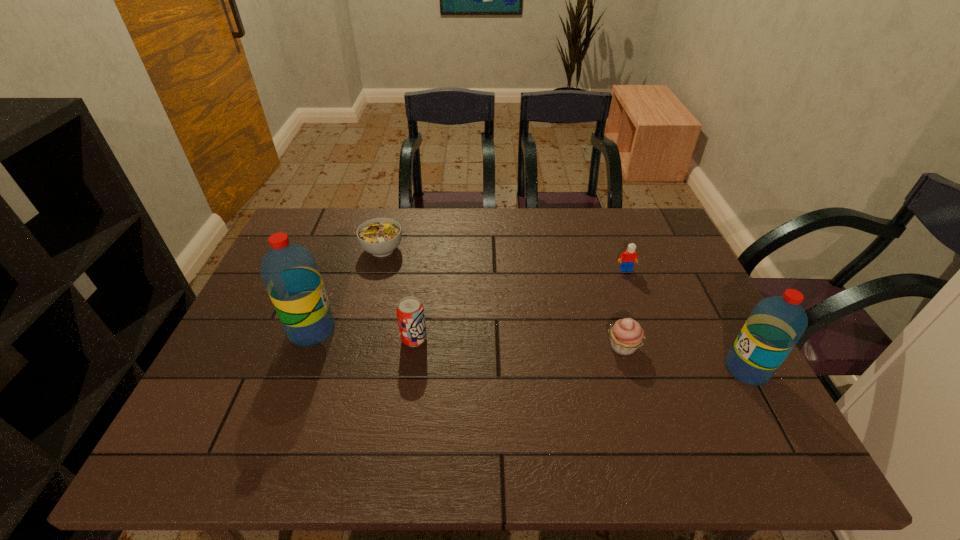
Locate an element on the screen. The image size is (960, 540). spot to insert another water_bottle for uniform distribution is located at coordinates (520, 349).